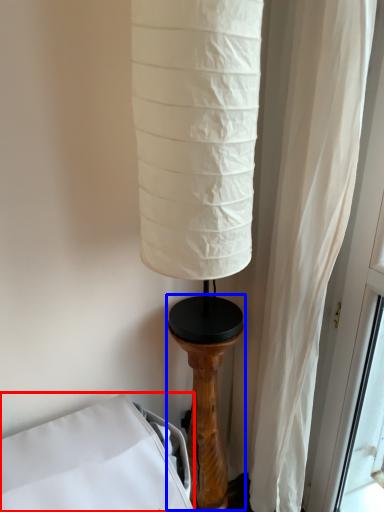
Question: Which object appears farthest to the camera in this image, furniture (highlighted by a red box) or pillar (highlighted by a blue box)?

Choices:
 (A) furniture
 (B) pillar

Answer: (B)